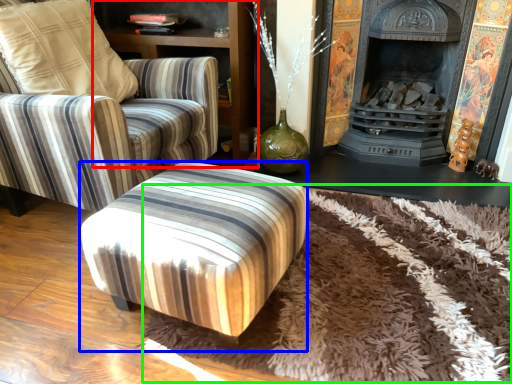
Question: Estimate the real-world distances between objects in this image. Which object is closer to dresser (highlighted by a red box), stool (highlighted by a blue box) or mat (highlighted by a green box)?

Choices:
 (A) stool
 (B) mat

Answer: (A)